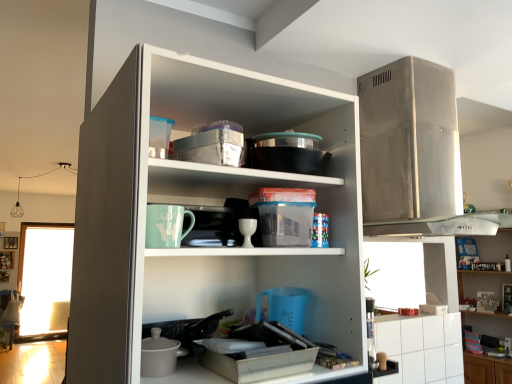
Image resolution: width=512 pixels, height=384 pixels. What do you see at coordinates (166, 225) in the screenshot?
I see `matte ceramic mug at center, placed as the first appliance when sorted from bottom to top` at bounding box center [166, 225].

The width and height of the screenshot is (512, 384). Identify the location of white glossy cup at center. coord(247,230).

I want to click on stainless steel range hood at upper right, which is the 2th appliance from front to back, so click(x=412, y=152).

Consider the image. What is the approximate height of stainless steel range hood at upper right, the first appliance when ordered from back to front?

stainless steel range hood at upper right, the first appliance when ordered from back to front, is 74.85 centimeters tall.

What do you see at coordinates (45, 277) in the screenshot?
I see `transparent glass window at left` at bounding box center [45, 277].

What do you see at coordinates (422, 348) in the screenshot? I see `white glossy cabinet at lower right` at bounding box center [422, 348].

Identify the location of white matte cupboard at center. (205, 204).

The height and width of the screenshot is (384, 512). Identify the location of matte ceramic mug at center, the second appliance from the top. (166, 225).

Which point is more forward, (26,265) or (149,229)?

The point (149,229) is in front.

Is transparent glass window at left looking in the opposite direction of matte ceramic mug at center, placed as the first appliance when sorted from bottom to top?

That's not correct — transparent glass window at left is not looking away from matte ceramic mug at center, placed as the first appliance when sorted from bottom to top.

Can you confirm if transparent glass window at left is taller than matte ceramic mug at center, placed as the first appliance when sorted from bottom to top?

Indeed, transparent glass window at left has a greater height compared to matte ceramic mug at center, placed as the first appliance when sorted from bottom to top.

Consider the image. From a real-world perspective, is transparent glass window at left located beneath matte ceramic mug at center, the first appliance when ordered from front to back?

Yes, from a real-world perspective, transparent glass window at left is under matte ceramic mug at center, the first appliance when ordered from front to back.

Who is more distant, white glossy cabinet at lower right or matte ceramic mug at center, the first appliance when ordered from front to back?

Positioned behind is white glossy cabinet at lower right.

From the picture: Considering the relative sizes of white glossy cabinet at lower right and matte ceramic mug at center, the first appliance when ordered from front to back, in the image provided, is white glossy cabinet at lower right smaller than matte ceramic mug at center, the first appliance when ordered from front to back,?

No, white glossy cabinet at lower right is not smaller than matte ceramic mug at center, the first appliance when ordered from front to back.

Is white glossy cabinet at lower right facing away from matte ceramic mug at center, the second appliance from the top?

No, white glossy cabinet at lower right's orientation is not away from matte ceramic mug at center, the second appliance from the top.

Considering the positions of objects white glossy cabinet at upper right and white matte cupboard at center in the image provided, who is more to the right, white glossy cabinet at upper right or white matte cupboard at center?

white glossy cabinet at upper right is more to the right.

Does white glossy cabinet at upper right have a greater width compared to white matte cupboard at center?

Incorrect, the width of white glossy cabinet at upper right does not surpass that of white matte cupboard at center.

Is white glossy cabinet at upper right not inside white matte cupboard at center?

Absolutely, white glossy cabinet at upper right is external to white matte cupboard at center.

Considering the sizes of objects white glossy cabinet at upper right and white matte cupboard at center in the image provided, who is bigger, white glossy cabinet at upper right or white matte cupboard at center?

With larger size is white glossy cabinet at upper right.

Considering the sizes of transparent glass window at left and white matte cupboard at center in the image, is transparent glass window at left taller or shorter than white matte cupboard at center?

transparent glass window at left is taller than white matte cupboard at center.

Is transparent glass window at left to the left of white matte cupboard at center from the viewer's perspective?

Indeed, transparent glass window at left is positioned on the left side of white matte cupboard at center.

Is transparent glass window at left positioned far away from white matte cupboard at center?

transparent glass window at left is positioned a significant distance from white matte cupboard at center.

Looking at the image, does transparent glass window at left seem bigger or smaller compared to white matte cupboard at center?

transparent glass window at left is smaller than white matte cupboard at center.

From a real-world perspective, which is physically above, matte ceramic mug at center, the first appliance when ordered from front to back, or transparent glass window at left?

matte ceramic mug at center, the first appliance when ordered from front to back.

Does matte ceramic mug at center, which appears as the 2th appliance when viewed from the right, have a lesser width compared to transparent glass window at left?

Indeed, matte ceramic mug at center, which appears as the 2th appliance when viewed from the right, has a lesser width compared to transparent glass window at left.

Between matte ceramic mug at center, which is counted as the 1th appliance, starting from the left, and transparent glass window at left, which one is positioned behind?

Positioned behind is transparent glass window at left.

Which of these two, white glossy cabinet at upper right or transparent glass window at left, is thinner?

Thinner between the two is transparent glass window at left.

Is white glossy cabinet at upper right taller or shorter than transparent glass window at left?

Clearly, white glossy cabinet at upper right is shorter compared to transparent glass window at left.

From a real-world perspective, is white glossy cabinet at upper right physically located above or below transparent glass window at left?

In terms of real-world spatial position, white glossy cabinet at upper right is above transparent glass window at left.

Who is shorter, stainless steel range hood at upper right, which is the first appliance in top-to-bottom order, or white glossy cabinet at upper right?

With less height is stainless steel range hood at upper right, which is the first appliance in top-to-bottom order.

Does stainless steel range hood at upper right, the second appliance positioned from the left, turn towards white glossy cabinet at upper right?

No, stainless steel range hood at upper right, the second appliance positioned from the left, is not turned towards white glossy cabinet at upper right.

Can you confirm if stainless steel range hood at upper right, the first appliance when ordered from back to front, is bigger than white glossy cabinet at upper right?

No, stainless steel range hood at upper right, the first appliance when ordered from back to front, is not bigger than white glossy cabinet at upper right.

Is stainless steel range hood at upper right, the first appliance when ordered from back to front, at the left side of white glossy cabinet at upper right?

Yes, stainless steel range hood at upper right, the first appliance when ordered from back to front, is to the left of white glossy cabinet at upper right.

The width and height of the screenshot is (512, 384). In the image, there is a matte ceramic mug at center, which is counted as the 1th appliance, starting from the left. In order to click on window screen below it (from the image's perspective) in this screenshot , I will do `click(45, 277)`.

From the white glossy cabinet at lower right, count the 2nd appliance to the left and point to it. Please provide its 2D coordinates.

[(166, 225)]

Estimate the real-world distances between objects in this image. Which object is further from white glossy cabinet at upper right, white glossy cabinet at lower right or transparent glass window at left?

transparent glass window at left is further to white glossy cabinet at upper right.

Considering their positions, is stainless steel range hood at upper right, the first appliance when ordered from back to front, positioned further to matte ceramic mug at center, placed as the first appliance when sorted from bottom to top, than white glossy cup at center?

stainless steel range hood at upper right, the first appliance when ordered from back to front, is positioned further to the anchor matte ceramic mug at center, placed as the first appliance when sorted from bottom to top.

Considering their positions, is white glossy cabinet at upper right positioned further to transparent glass window at left than white glossy cup at center?

white glossy cup at center is positioned further to the anchor transparent glass window at left.

Estimate the real-world distances between objects in this image. Which object is further from white glossy cup at center, transparent glass window at left or white glossy cabinet at lower right?

Based on the image, transparent glass window at left appears to be further to white glossy cup at center.

Based on their spatial positions, is white matte cupboard at center or white glossy cup at center further from matte ceramic mug at center, which appears as the 2th appliance when viewed from the right?

white matte cupboard at center lies further to matte ceramic mug at center, which appears as the 2th appliance when viewed from the right, than the other object.

In the scene shown: Based on their spatial positions, is white matte cupboard at center or transparent glass window at left further from stainless steel range hood at upper right, the second appliance positioned from the left?

transparent glass window at left is further to stainless steel range hood at upper right, the second appliance positioned from the left.

In the scene shown: Based on their spatial positions, is stainless steel range hood at upper right, acting as the second appliance starting from the bottom, or matte ceramic mug at center, which is counted as the 1th appliance, starting from the left, further from white matte cupboard at center?

The object further to white matte cupboard at center is stainless steel range hood at upper right, acting as the second appliance starting from the bottom.

Looking at this image, based on their spatial positions, is transparent glass window at left or white glossy cabinet at lower right closer to white matte cupboard at center?

Among the two, white glossy cabinet at lower right is located nearer to white matte cupboard at center.

Locate an element on the screen. appliance situated between matte ceramic mug at center, the second appliance from the top, and white glossy cabinet at lower right from left to right is located at coordinates (412, 152).

The image size is (512, 384). I want to click on tableware between white matte cupboard at center and transparent glass window at left in the front-back direction, so click(247, 230).

At what (x,y) coordinates should I click in order to perform the action: click on appliance between matte ceramic mug at center, the second appliance from the top, and transparent glass window at left from front to back. Please return your answer as a coordinate pair (x, y). Looking at the image, I should click on (412, 152).

This screenshot has height=384, width=512. I want to click on cabinetry between stainless steel range hood at upper right, which is the first appliance in top-to-bottom order, and transparent glass window at left from front to back, so click(422, 348).